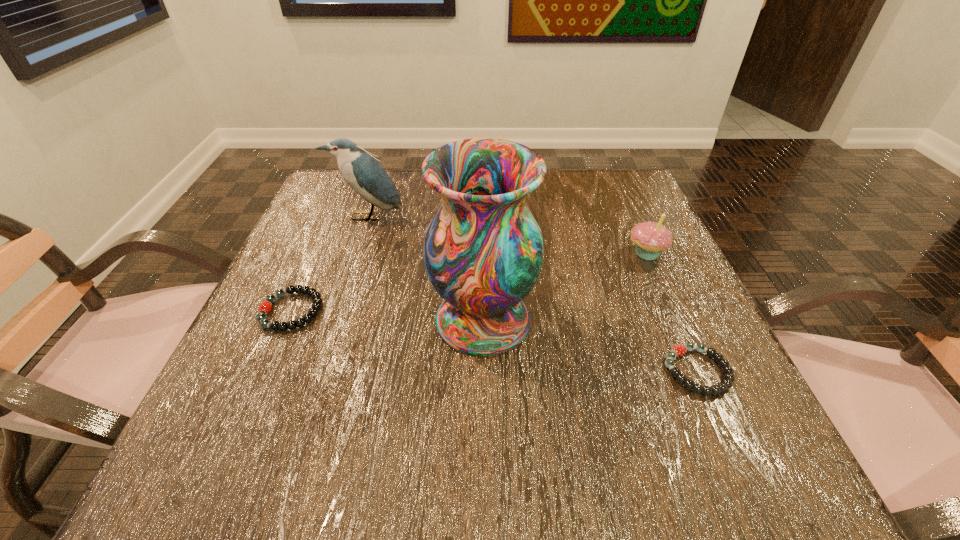
This screenshot has height=540, width=960. I want to click on free space between the left bracelet and the bird, so click(329, 264).

Where is `unoccupied position between the cupcake and the nearer bracelet`? unoccupied position between the cupcake and the nearer bracelet is located at coordinates (672, 312).

Where is `free spot between the fourth shortest object and the right bracelet`? free spot between the fourth shortest object and the right bracelet is located at coordinates (532, 294).

What are the coordinates of `object that ranks as the fourth closest to the right bracelet` in the screenshot? It's located at (364, 174).

Choose which object is the fourth nearest neighbor to the third object from right to left. Please provide its 2D coordinates. Your answer should be formatted as a tuple, i.e. [(x, y)], where the tuple contains the x and y coordinates of a point satisfying the conditions above.

[(364, 174)]

Locate an element on the screen. The width and height of the screenshot is (960, 540). vacant space that satisfies the following two spatial constraints: 1. on the back side of the second farthest object; 2. on the left side of the left bracelet is located at coordinates (317, 253).

The height and width of the screenshot is (540, 960). In order to click on free space that satisfies the following two spatial constraints: 1. at the tip of the bird's beak; 2. on the left side of the third shortest object in this screenshot , I will do `click(355, 253)`.

At what (x,y) coordinates should I click in order to perform the action: click on vacant point that satisfies the following two spatial constraints: 1. at the tip of the second tallest object's beak; 2. on the right side of the cupcake. Please return your answer as a coordinate pair (x, y). This screenshot has height=540, width=960. Looking at the image, I should click on (355, 253).

Locate an element on the screen. vacant space that satisfies the following two spatial constraints: 1. on the back side of the cupcake; 2. on the left side of the farther bracelet is located at coordinates (317, 253).

You are a GUI agent. You are given a task and a screenshot of the screen. Output one action in this format:
    pyautogui.click(x=<x>, y=<y>)
    Task: Click on the free space that satisfies the following two spatial constraints: 1. at the tip of the tallest object's beak; 2. on the left side of the second tallest object
    The height and width of the screenshot is (540, 960).
    Given the screenshot: What is the action you would take?
    pyautogui.click(x=332, y=320)